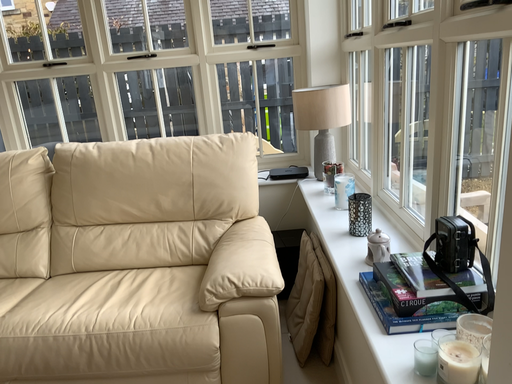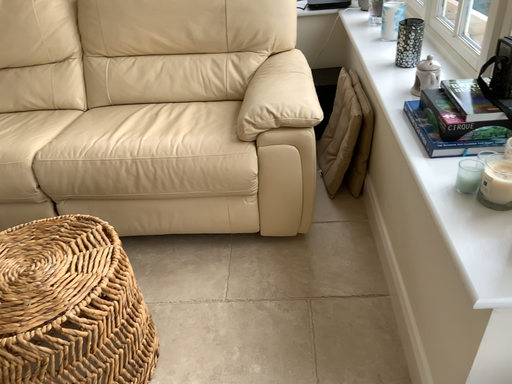
Question: How did the camera likely rotate when shooting the video?

Choices:
 (A) rotated downward
 (B) rotated upward

Answer: (A)